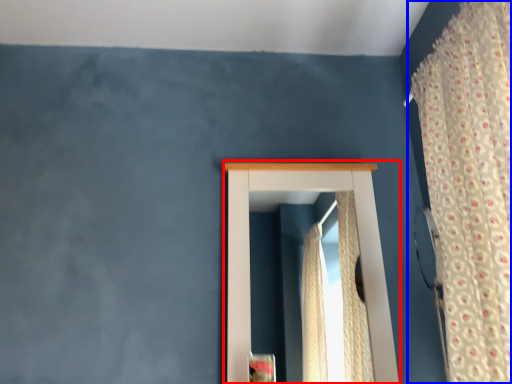
Question: Among these objects, which one is nearest to the camera, window (highlighted by a red box) or curtain (highlighted by a blue box)?

Choices:
 (A) window
 (B) curtain

Answer: (B)